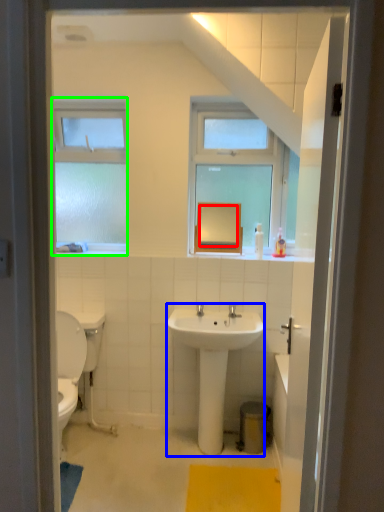
Question: Which object is positioned closest to mirror (highlighted by a red box)? Select from sink (highlighted by a blue box) and window (highlighted by a green box).

Choices:
 (A) sink
 (B) window

Answer: (A)